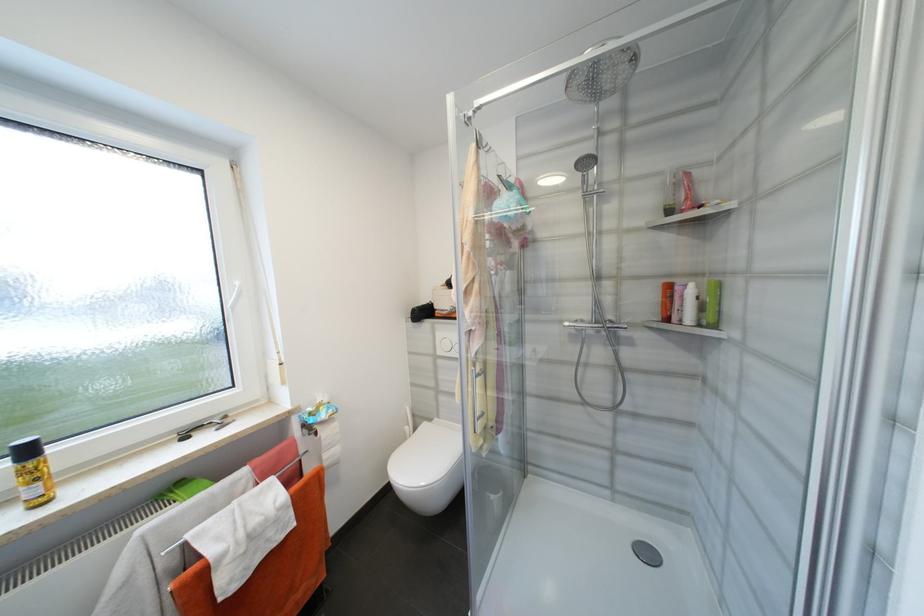
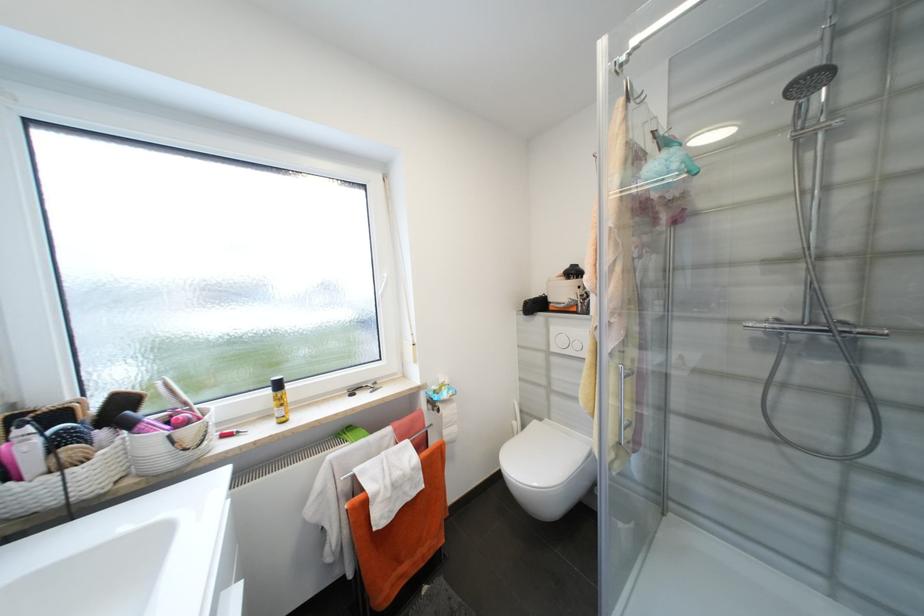
Question: The first image is from the beginning of the video and the second image is from the end. How did the camera likely rotate when shooting the video?

Choices:
 (A) Left
 (B) Right
 (C) Up
 (D) Down

Answer: (A)